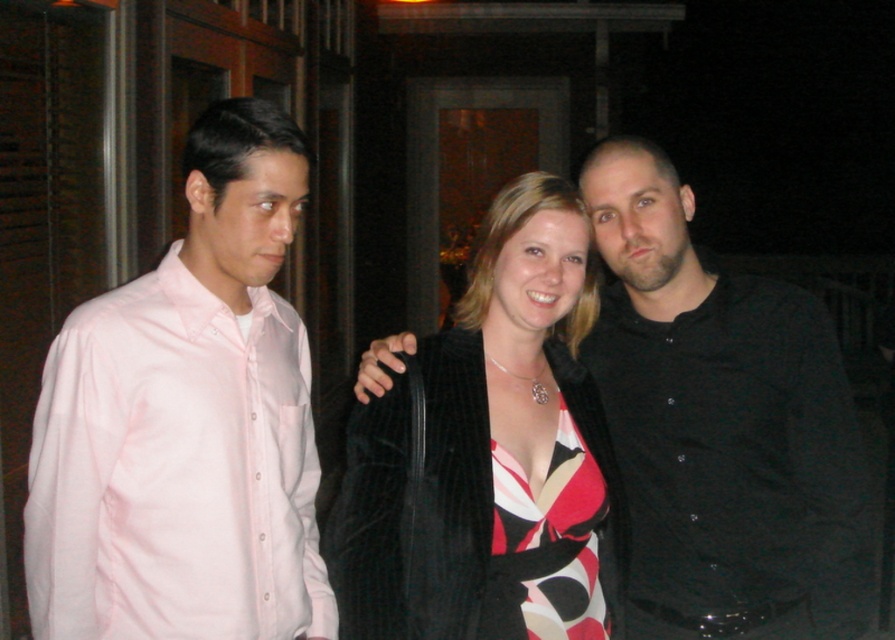
Is velvet black coat at center thinner than printed silk dress at center?

Incorrect, velvet black coat at center's width is not less than printed silk dress at center's.

Between velvet black coat at center and printed silk dress at center, which one appears on the left side from the viewer's perspective?

velvet black coat at center

Is point (621, 520) behind point (564, 470)?

Yes, point (621, 520) is behind point (564, 470).

Where is `velvet black coat at center`? velvet black coat at center is located at coordinates (487, 454).

Which is above, pink satin shirt at left or velvet black coat at center?

velvet black coat at center is higher up.

Who is positioned more to the right, pink satin shirt at left or velvet black coat at center?

From the viewer's perspective, velvet black coat at center appears more on the right side.

Who is more distant from viewer, (131, 608) or (484, 464)?

Positioned behind is point (484, 464).

Where is `pink satin shirt at left`? The width and height of the screenshot is (895, 640). pink satin shirt at left is located at coordinates (175, 470).

Can you confirm if pink satin shirt at left is wider than printed silk dress at center?

Indeed, pink satin shirt at left has a greater width compared to printed silk dress at center.

Is pink satin shirt at left shorter than printed silk dress at center?

No, pink satin shirt at left is not shorter than printed silk dress at center.

What do you see at coordinates (175, 470) in the screenshot? This screenshot has height=640, width=895. I see `pink satin shirt at left` at bounding box center [175, 470].

Locate an element on the screen. The image size is (895, 640). pink satin shirt at left is located at coordinates (175, 470).